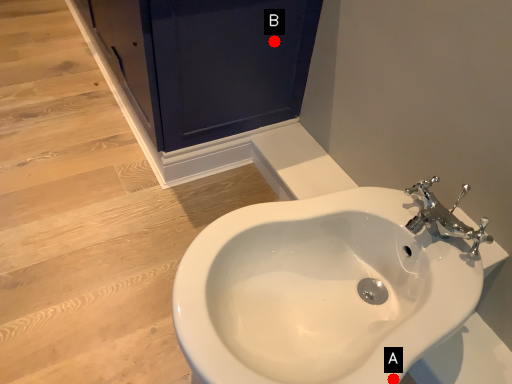
Question: Two points are circled on the image, labeled by A and B beside each circle. Which point appears closest to the camera in this image?

Choices:
 (A) A is closer
 (B) B is closer

Answer: (A)